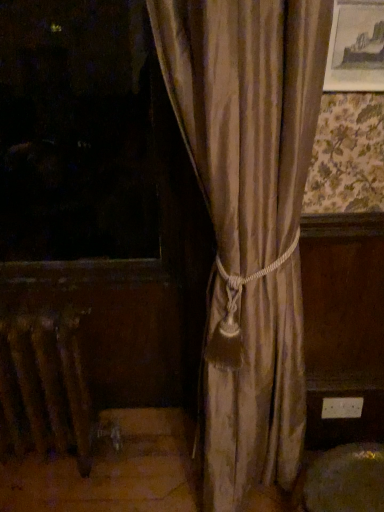
The height and width of the screenshot is (512, 384). I want to click on metallic radiator at lower left, so click(x=44, y=387).

Measure the distance between metallic radiator at lower left and camera.

metallic radiator at lower left is 1.36 meters from camera.

The width and height of the screenshot is (384, 512). What do you see at coordinates (44, 387) in the screenshot?
I see `metallic radiator at lower left` at bounding box center [44, 387].

At what (x,y) coordinates should I click in order to perform the action: click on wooden picture frame at upper right. Please return your answer as a coordinate pair (x, y). Looking at the image, I should click on (356, 47).

Describe the element at coordinates (356, 47) in the screenshot. The image size is (384, 512). I see `wooden picture frame at upper right` at that location.

Find the location of a particular element. Image resolution: width=384 pixels, height=512 pixels. metallic radiator at lower left is located at coordinates 44,387.

Between wooden picture frame at upper right and metallic radiator at lower left, which one appears on the right side from the viewer's perspective?

wooden picture frame at upper right.

Is the depth of wooden picture frame at upper right greater than that of metallic radiator at lower left?

That is False.

Which is closer to the camera, (373,40) or (42,432)?

Result: Point (373,40) is closer to the camera than point (42,432).

From the image's perspective, is wooden picture frame at upper right over metallic radiator at lower left?

Yes.

From a real-world perspective, which object rests below the other?

metallic radiator at lower left is physically lower.

Considering the sizes of objects wooden picture frame at upper right and metallic radiator at lower left in the image provided, who is thinner, wooden picture frame at upper right or metallic radiator at lower left?

With smaller width is wooden picture frame at upper right.

From their relative heights in the image, would you say wooden picture frame at upper right is taller or shorter than metallic radiator at lower left?

In the image, wooden picture frame at upper right appears to be shorter than metallic radiator at lower left.

Between wooden picture frame at upper right and metallic radiator at lower left, which one has smaller size?

With smaller size is wooden picture frame at upper right.

Would you say wooden picture frame at upper right contains metallic radiator at lower left?

Actually, metallic radiator at lower left is outside wooden picture frame at upper right.

Is wooden picture frame at upper right next to metallic radiator at lower left?

No, wooden picture frame at upper right is not beside metallic radiator at lower left.

From the picture: Is wooden picture frame at upper right facing away from metallic radiator at lower left?

wooden picture frame at upper right is not turned away from metallic radiator at lower left.

The image size is (384, 512). I want to click on picture frame above the metallic radiator at lower left (from a real-world perspective), so click(x=356, y=47).

Is metallic radiator at lower left at the right side of wooden picture frame at upper right?

No, metallic radiator at lower left is not to the right of wooden picture frame at upper right.

Is metallic radiator at lower left positioned before wooden picture frame at upper right?

No, the depth of metallic radiator at lower left is greater than that of wooden picture frame at upper right.

Looking at this image, which point is more forward, (43, 413) or (358, 73)?

Positioned in front is point (358, 73).

From the picture: From the image's perspective, is metallic radiator at lower left below wooden picture frame at upper right?

Indeed, from the image's perspective, metallic radiator at lower left is shown beneath wooden picture frame at upper right.

Based on the photo, from a real-world perspective, is metallic radiator at lower left located beneath wooden picture frame at upper right?

Yes, from a real-world perspective, metallic radiator at lower left is under wooden picture frame at upper right.

Considering the sizes of objects metallic radiator at lower left and wooden picture frame at upper right in the image provided, who is wider, metallic radiator at lower left or wooden picture frame at upper right?

With larger width is metallic radiator at lower left.

Which of these two, metallic radiator at lower left or wooden picture frame at upper right, stands taller?

With more height is metallic radiator at lower left.

Who is smaller, metallic radiator at lower left or wooden picture frame at upper right?

Smaller between the two is wooden picture frame at upper right.

Is wooden picture frame at upper right completely or partially inside metallic radiator at lower left?

No, wooden picture frame at upper right is not a part of metallic radiator at lower left.

Is metallic radiator at lower left next to wooden picture frame at upper right?

No, metallic radiator at lower left is not beside wooden picture frame at upper right.

Is metallic radiator at lower left positioned with its back to wooden picture frame at upper right?

No, metallic radiator at lower left is not facing away from wooden picture frame at upper right.

From the picture: How many degrees apart are the facing directions of metallic radiator at lower left and wooden picture frame at upper right?

There is a 0.244-degree angle between the facing directions of metallic radiator at lower left and wooden picture frame at upper right.

How far apart are metallic radiator at lower left and wooden picture frame at upper right?

metallic radiator at lower left and wooden picture frame at upper right are 1.29 meters apart.

Where is `picture frame that appears above the metallic radiator at lower left (from the image's perspective)`? picture frame that appears above the metallic radiator at lower left (from the image's perspective) is located at coordinates (356, 47).

Where is `radiator on the left of wooden picture frame at upper right`? The image size is (384, 512). radiator on the left of wooden picture frame at upper right is located at coordinates (44, 387).

Where is `picture frame that appears above the metallic radiator at lower left (from a real-world perspective)`? This screenshot has width=384, height=512. picture frame that appears above the metallic radiator at lower left (from a real-world perspective) is located at coordinates (356, 47).